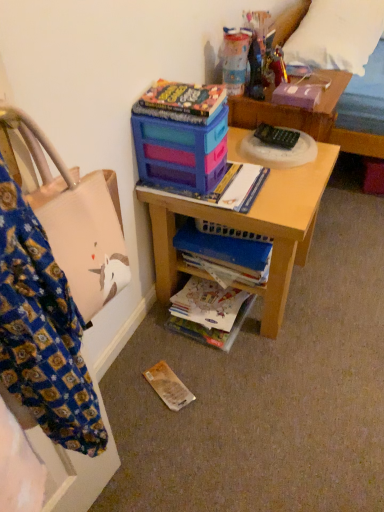
Where is `vacant region in front of black plastic remote control at center`? This screenshot has width=384, height=512. vacant region in front of black plastic remote control at center is located at coordinates (291, 176).